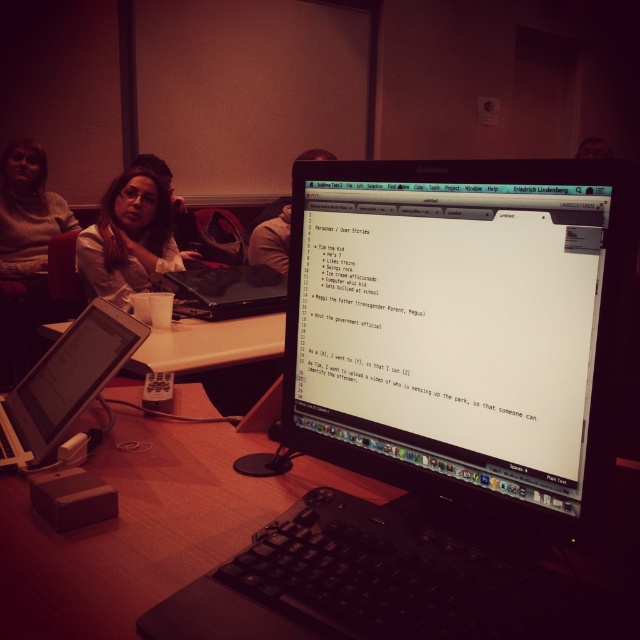
Does silver metallic laptop at lower left have a greater height compared to white plastic table at center?

Yes.

Between silver metallic laptop at lower left and white plastic table at center, which one is positioned lower?

Positioned lower is silver metallic laptop at lower left.

Does point (12, 422) come in front of point (172, 369)?

That is True.

Image resolution: width=640 pixels, height=640 pixels. What are the coordinates of `silver metallic laptop at lower left` in the screenshot? It's located at (65, 381).

Describe the element at coordinates (461, 326) in the screenshot. I see `black glossy monitor at center` at that location.

Can you confirm if black glossy monitor at center is thinner than black matte laptop at center?

Yes, black glossy monitor at center is thinner than black matte laptop at center.

What do you see at coordinates (461, 326) in the screenshot? The height and width of the screenshot is (640, 640). I see `black glossy monitor at center` at bounding box center [461, 326].

At what (x,y) coordinates should I click in order to perform the action: click on black glossy monitor at center. Please return your answer as a coordinate pair (x, y). This screenshot has width=640, height=640. Looking at the image, I should click on (461, 326).

What do you see at coordinates (209, 344) in the screenshot?
I see `white plastic table at center` at bounding box center [209, 344].

Who is more forward, [237,340] or [214,273]?

Point [237,340] is in front.

The height and width of the screenshot is (640, 640). I want to click on white plastic table at center, so click(209, 344).